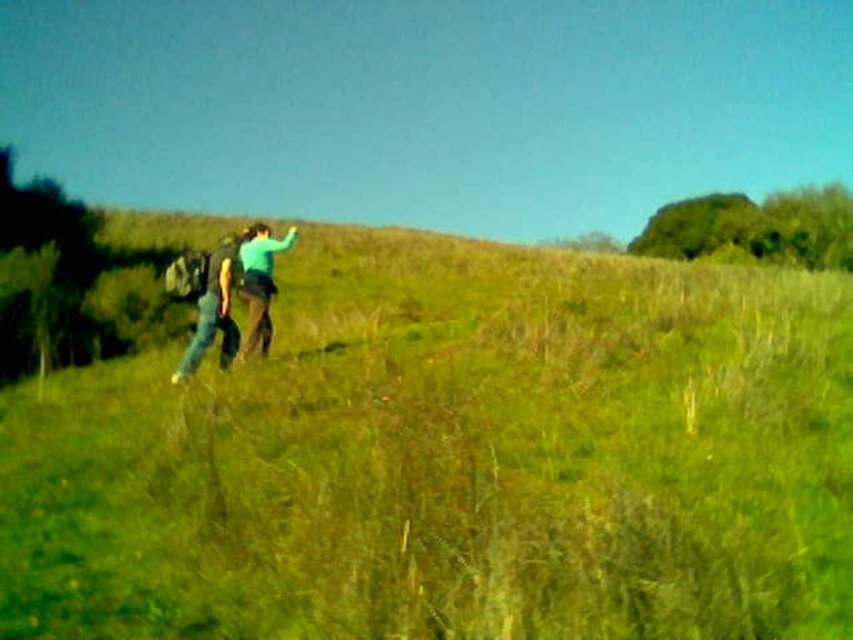
Which is in front, point (207, 317) or point (239, 280)?

Point (207, 317)

The height and width of the screenshot is (640, 853). What do you see at coordinates (210, 301) in the screenshot?
I see `denim pants at left` at bounding box center [210, 301].

At what (x,y) coordinates should I click in order to perform the action: click on denim pants at left. Please return your answer as a coordinate pair (x, y). Image resolution: width=853 pixels, height=640 pixels. Looking at the image, I should click on pos(210,301).

Does point (227, 452) come closer to viewer compared to point (258, 243)?

Yes.

This screenshot has width=853, height=640. I want to click on green grassy hillside at center, so pos(454,458).

Is green grassy hillside at center in front of denim pants at left?

Yes, it is in front of denim pants at left.

Can you confirm if green grassy hillside at center is thinner than denim pants at left?

In fact, green grassy hillside at center might be wider than denim pants at left.

Find the location of a particular element. The image size is (853, 640). green grassy hillside at center is located at coordinates (454, 458).